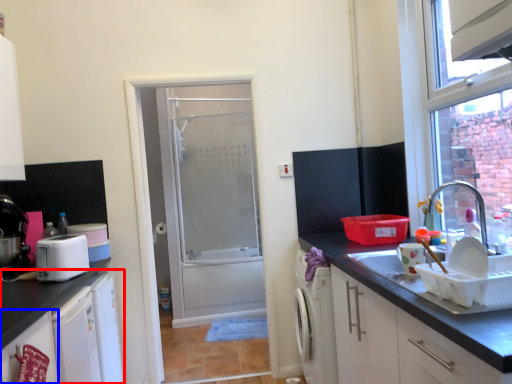
Question: Which object is closer to the camera taking this photo, cabinetry (highlighted by a red box) or cabinetry (highlighted by a blue box)?

Choices:
 (A) cabinetry
 (B) cabinetry

Answer: (B)